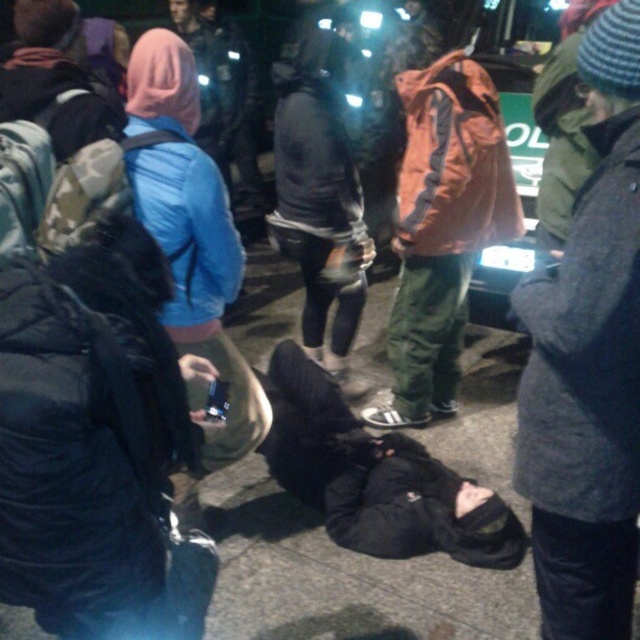
Which is behind, point (454, 77) or point (189, 20)?

The point (189, 20) is more distant.

Who is taller, orange fabric jacket at center or blue fabric jacket at upper left?

Standing taller between the two is orange fabric jacket at center.

Locate an element on the screen. orange fabric jacket at center is located at coordinates (442, 228).